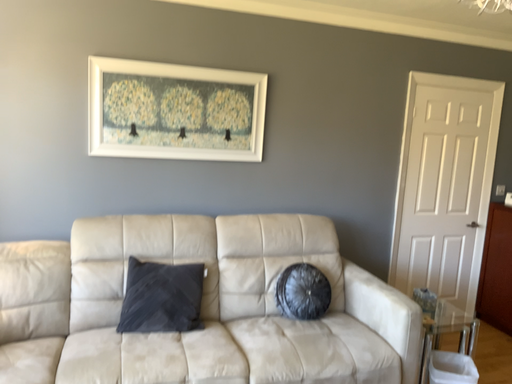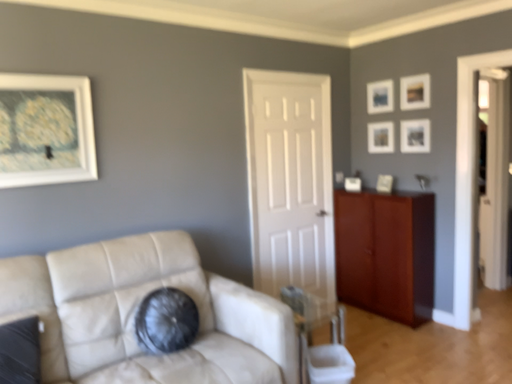
Question: Which way did the camera rotate in the video?

Choices:
 (A) rotated right
 (B) rotated left

Answer: (A)